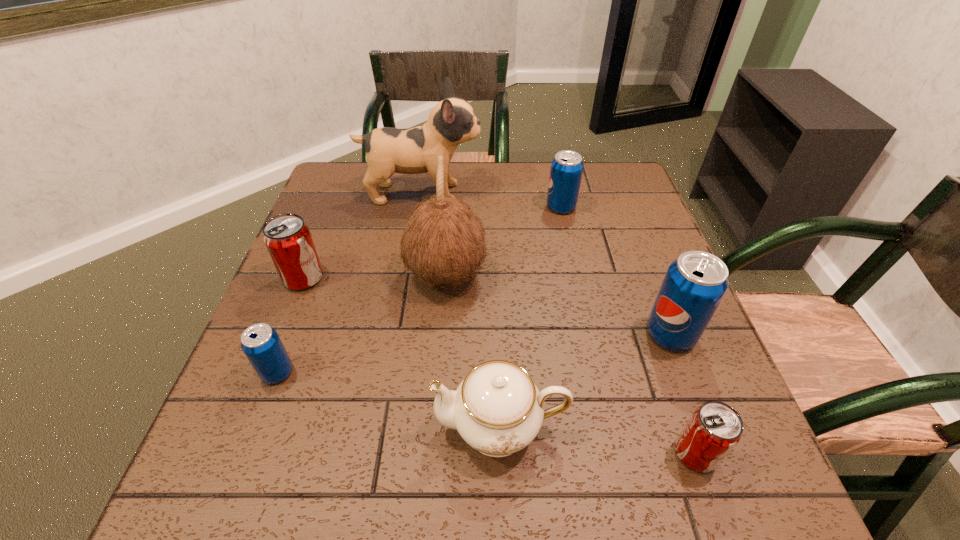
Where is `vacant space located 0.340m at the spout of the chinaware`? The height and width of the screenshot is (540, 960). vacant space located 0.340m at the spout of the chinaware is located at coordinates (240, 427).

Where is `vacant area situated on the front of the smallest blue pop soda`? vacant area situated on the front of the smallest blue pop soda is located at coordinates (258, 422).

Where is `vacant space located on the back of the nearer red pop soda`? vacant space located on the back of the nearer red pop soda is located at coordinates (669, 378).

The width and height of the screenshot is (960, 540). Identify the location of puppy located in the far edge section of the desktop. (451, 122).

Where is `pop soda that is at the far edge`? pop soda that is at the far edge is located at coordinates (566, 170).

Locate an element on the screen. This screenshot has width=960, height=540. chinaware present at the near edge is located at coordinates (497, 409).

The height and width of the screenshot is (540, 960). Identify the location of pop soda present at the near edge. (715, 428).

This screenshot has width=960, height=540. What are the coordinates of `puppy that is at the left edge` in the screenshot? It's located at (451, 122).

You are a GUI agent. You are given a task and a screenshot of the screen. Output one action in this format:
    pyautogui.click(x=<x>, y=<y>)
    Task: Click on the object positioned at the far left corner
    
    Given the screenshot: What is the action you would take?
    pyautogui.click(x=451, y=122)

Image resolution: width=960 pixels, height=540 pixels. I want to click on object positioned at the near right corner, so click(715, 428).